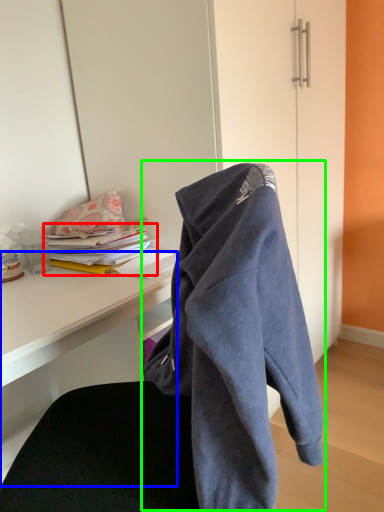
Question: Which object is positioned farthest from book (highlighted by a red box)? Select from desk (highlighted by a blue box) and bath towel (highlighted by a green box).

Choices:
 (A) desk
 (B) bath towel

Answer: (B)